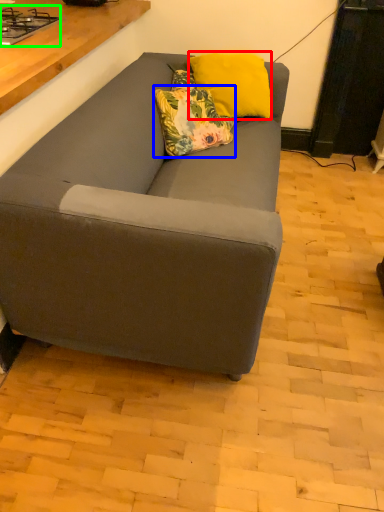
Question: Which is farther away from pillow (highlighted by a red box)? pillow (highlighted by a blue box) or gas stove (highlighted by a green box)?

Choices:
 (A) pillow
 (B) gas stove

Answer: (B)